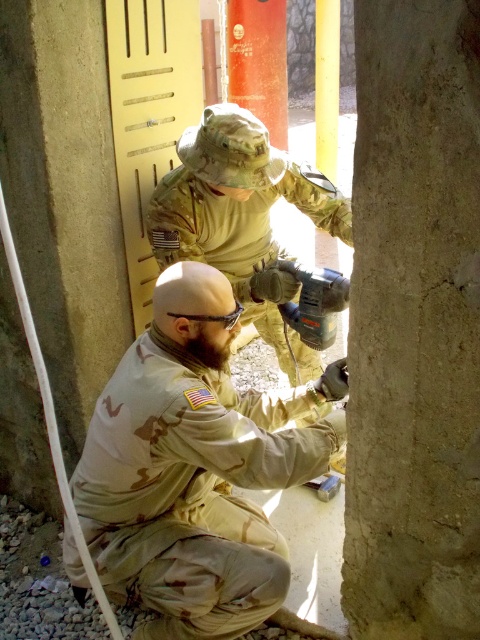
You are an observer standing in front of the construction site. You see the tan camouflage uniform at center and the metallic gray drill at center. Which object is located to the left?

The tan camouflage uniform at center is positioned on the left side of the metallic gray drill at center, so the tan camouflage uniform at center is located to the left.